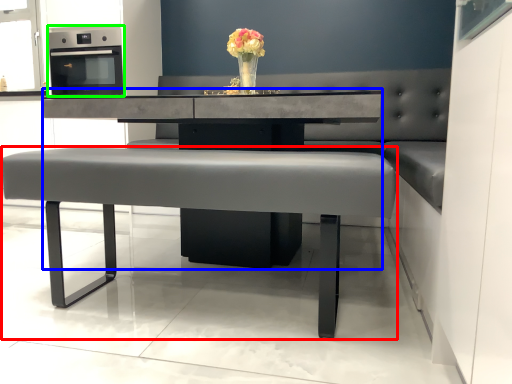
Question: Considering the real-world distances, which object is farthest from table (highlighted by a red box)? round table (highlighted by a blue box) or appliance (highlighted by a green box)?

Choices:
 (A) round table
 (B) appliance

Answer: (B)